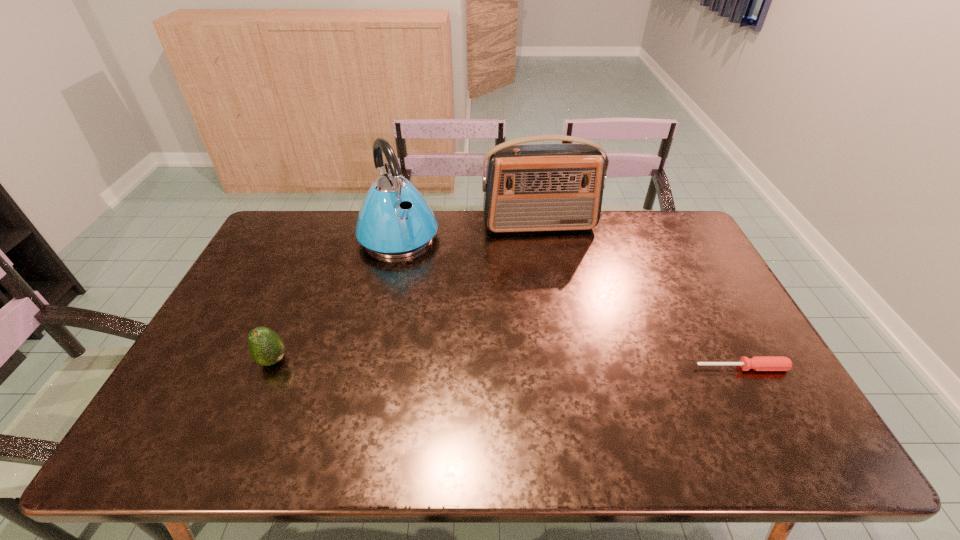
Identify which object is the nearest to the rightmost object. Please provide its 2D coordinates. Your answer should be formatted as a tuple, i.e. [(x, y)], where the tuple contains the x and y coordinates of a point satisfying the conditions above.

[(534, 187)]

Find the location of a particular element. Image resolution: width=960 pixels, height=540 pixels. object that is the third closest to the radio receiver is located at coordinates (266, 347).